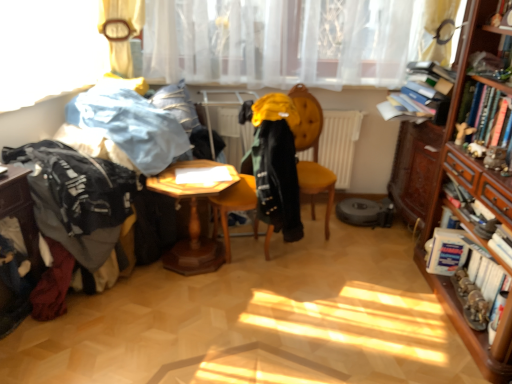
Where is `spots to the right of wooden hexagonal table at lower left, which is counted as the second table, starting from the right`? spots to the right of wooden hexagonal table at lower left, which is counted as the second table, starting from the right is located at coordinates (65, 336).